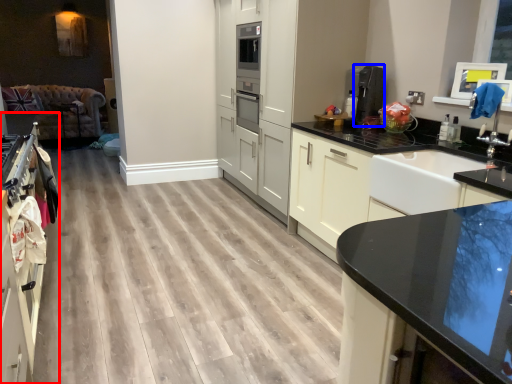
Question: Which point is closer to the camera, cabinetry (highlighted by a red box) or coffee machine (highlighted by a blue box)?

Choices:
 (A) cabinetry
 (B) coffee machine

Answer: (A)